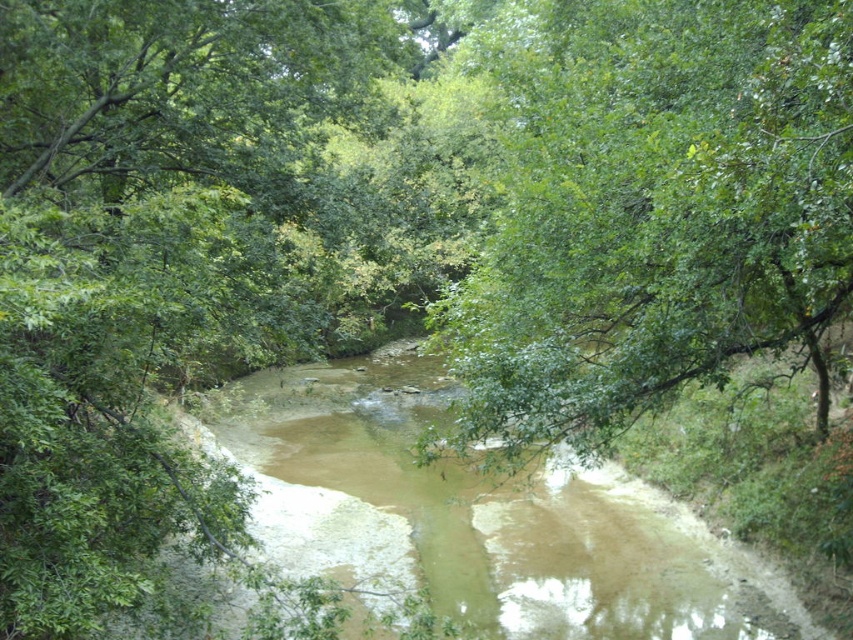
You are a kayaker planning to paddle down the river. You notice the green leafy tree at center and the brown sedimentary water at center. Which object is directly above the other?

The green leafy tree at center is positioned over the brown sedimentary water at center.

From the picture: You are a hiker who wants to cross the river at the center. The green leafy tree at center and brown sedimentary water at center are in your path. Which object is narrower, allowing you to navigate around it more easily?

The green leafy tree at center is thinner than brown sedimentary water at center, so it is narrower and easier to navigate around.

Based on the photo, you are a hiker standing at the edge of the river and want to take a photo of the green leafy tree at center and the brown sedimentary water at center. Which object is higher in the frame?

The green leafy tree at center is taller than the brown sedimentary water at center, so it will appear higher in the frame.